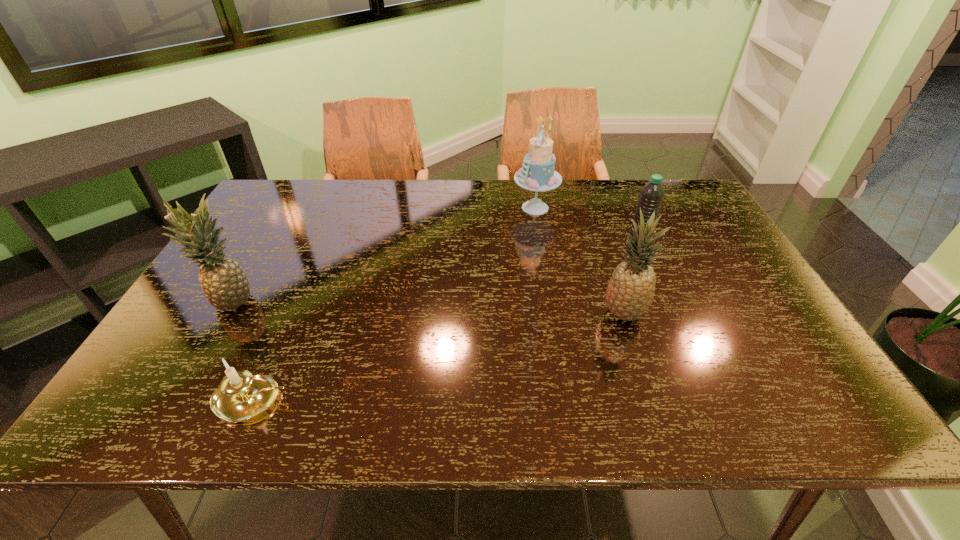
Where is `free location located with a ladder on the side of the farthest object`? The width and height of the screenshot is (960, 540). free location located with a ladder on the side of the farthest object is located at coordinates (396, 208).

Identify the location of free region located 0.390m on the right of the leftmost object. Image resolution: width=960 pixels, height=540 pixels. (408, 299).

Image resolution: width=960 pixels, height=540 pixels. In order to click on vacant space positioned on the back of the right pineapple in this screenshot , I will do `click(597, 235)`.

Identify the location of vacant space located 0.050m on the left of the rightmost object. The image size is (960, 540). [612, 240].

Where is `vacant space located on the handle side of the nearest object`? This screenshot has height=540, width=960. vacant space located on the handle side of the nearest object is located at coordinates (411, 400).

Where is `object that is at the far edge`? This screenshot has height=540, width=960. object that is at the far edge is located at coordinates (537, 174).

Find the location of `object located at the near edge`. object located at the near edge is located at coordinates (241, 396).

Find the location of a particular element. This screenshot has width=960, height=540. object present at the left edge is located at coordinates (225, 285).

The image size is (960, 540). In the image, there is a desktop. Find the location of `free region at the far edge`. free region at the far edge is located at coordinates pos(566,194).

Find the location of a particular element. free space at the near edge is located at coordinates (311, 404).